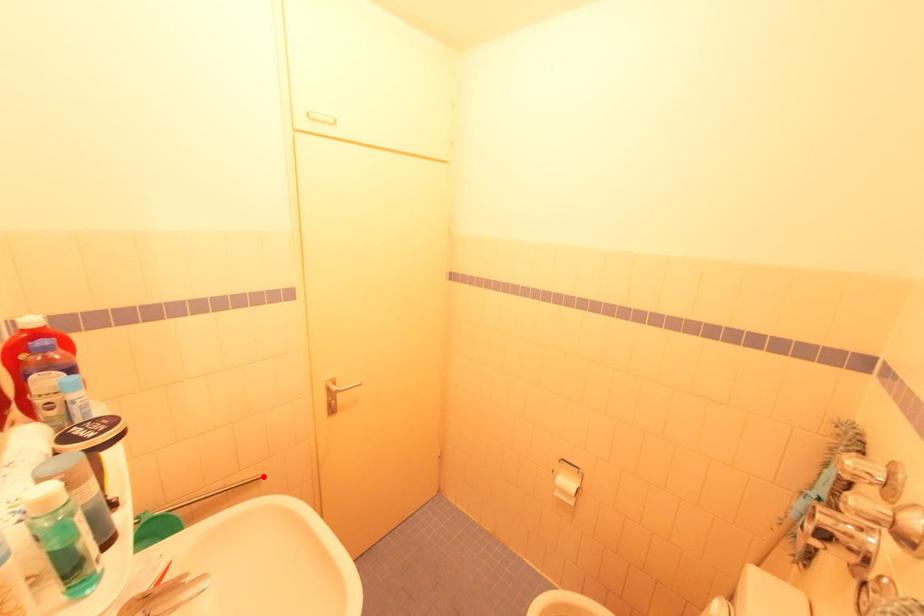
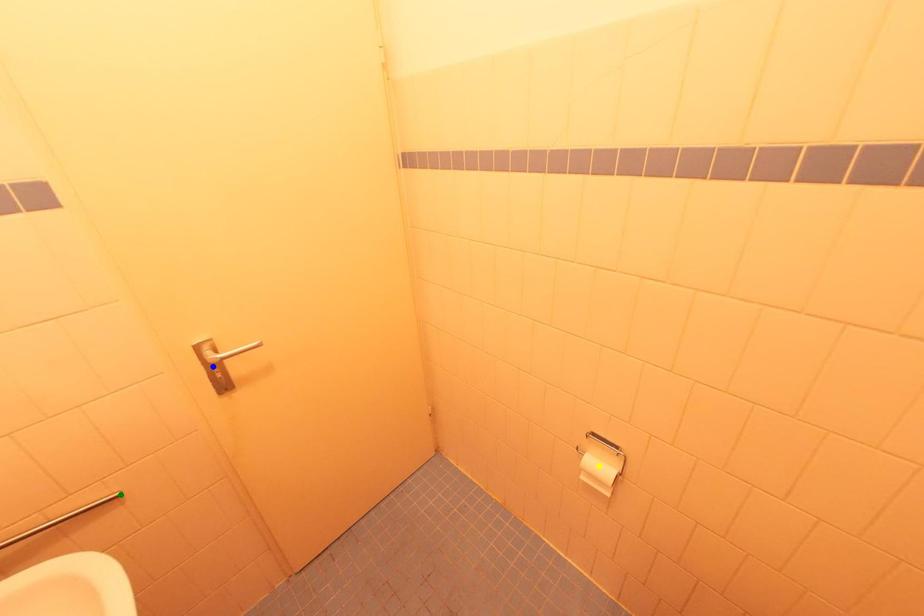
Question: I am providing you with two images of the same scene from different viewpoints. A red point is marked on the first image. You are given multiple points on the second image. Can you choose the point in image 2 that corresponds to the point in image 1?

Choices:
 (A) green point
 (B) blue point
 (C) yellow point

Answer: (A)